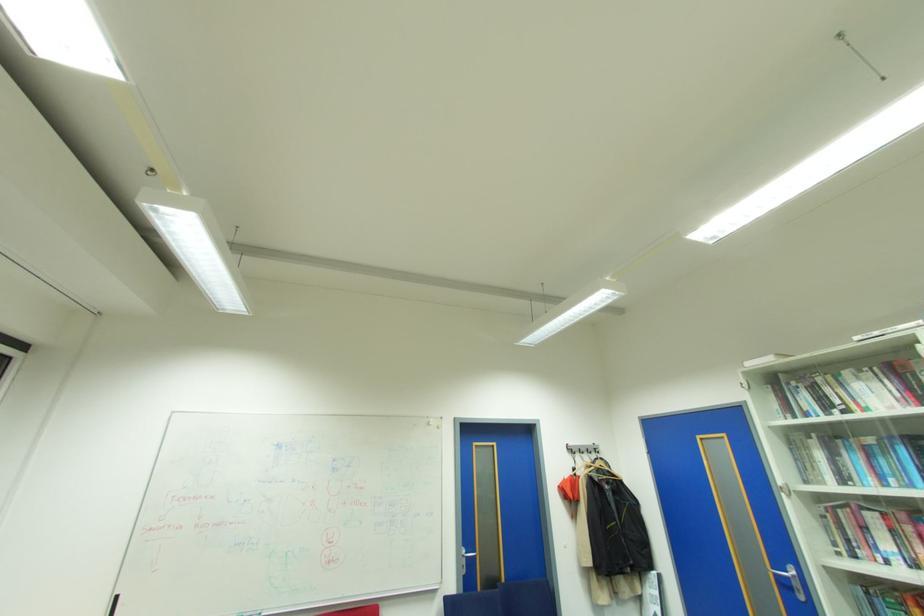
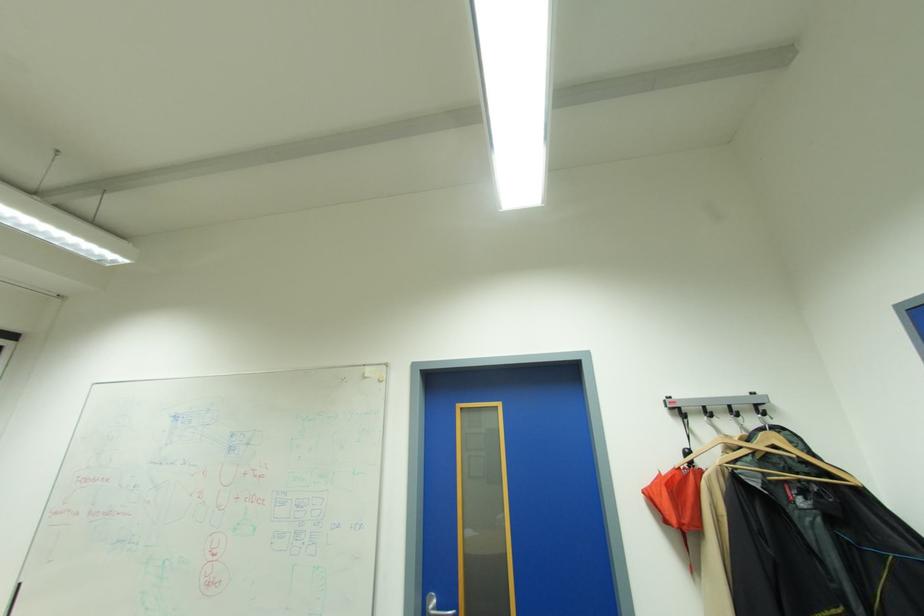
Where in the second image is the point corresponding to point (602, 461) from the first image?

(764, 434)